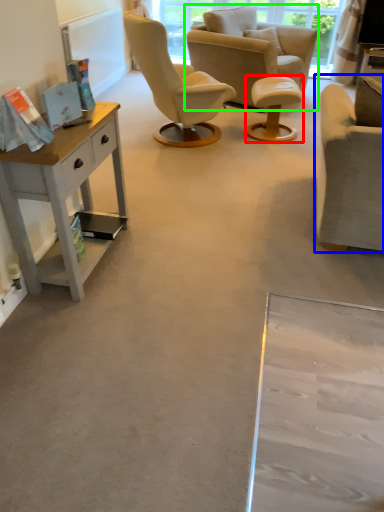
Question: Which is farther away from stool (highlighted by a red box)? chair (highlighted by a blue box) or chair (highlighted by a green box)?

Choices:
 (A) chair
 (B) chair

Answer: (A)